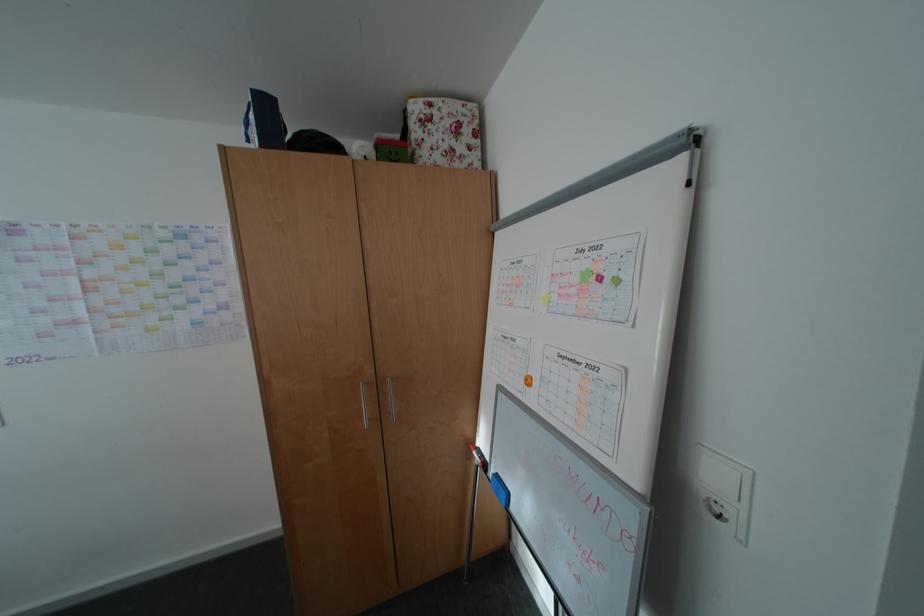
Find where to lift the blue whiteboard eraser. Please return your answer as a coordinate pair (x, y).

(500, 488)